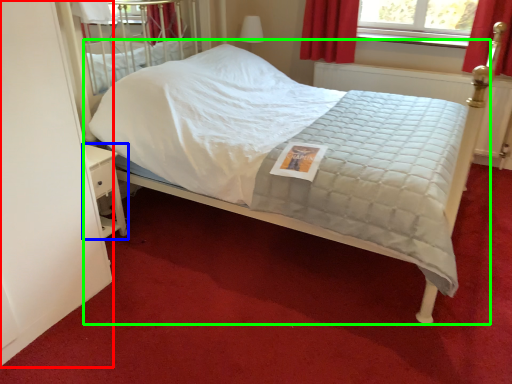
Question: Which object is the farthest from screen door (highlighted by a red box)? Choose among these: nightstand (highlighted by a blue box) or bed (highlighted by a green box).

Choices:
 (A) nightstand
 (B) bed

Answer: (B)